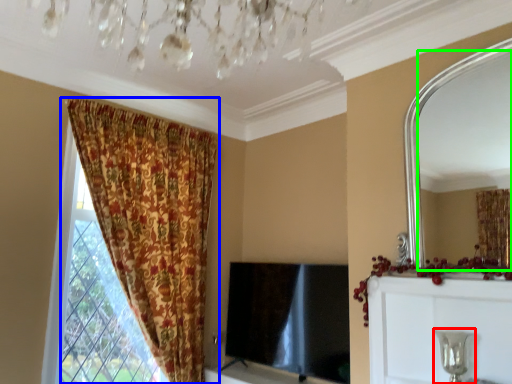
Question: Which is nearer to the candle holder (highlighted by a red box)? curtain (highlighted by a blue box) or mirror (highlighted by a green box).

Choices:
 (A) curtain
 (B) mirror

Answer: (A)